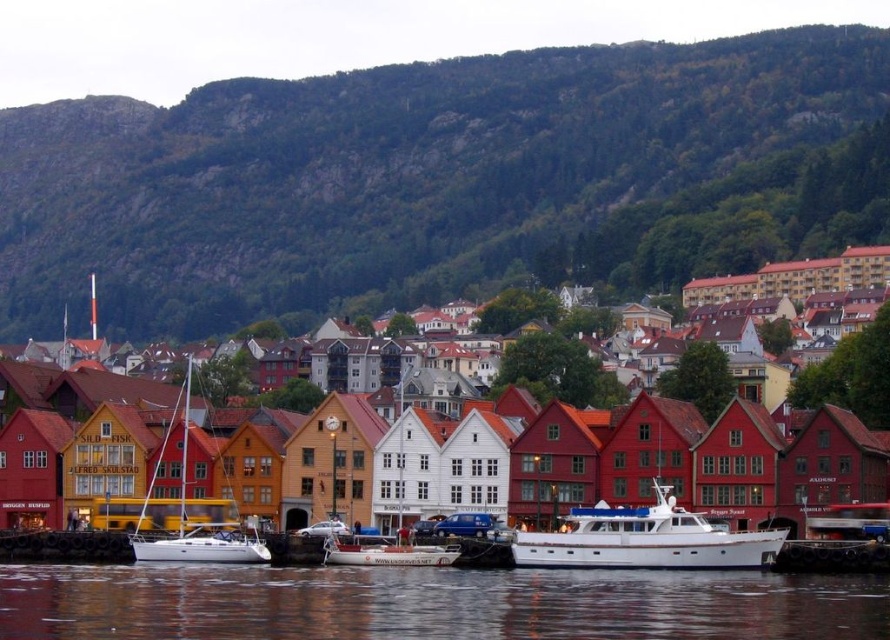
Consider the image. You are standing on the pier and see both the white glossy boat at center and the white matte boat at center. Which boat is positioned to the right side?

The white glossy boat at center is positioned to the right of the white matte boat at center.

You are standing on the pier looking out at the waterfront scene. You see the transparent water at lower center and the white glossy boat at center. Which object is located lower in the image?

The transparent water at lower center is located lower in the image than the white glossy boat at center.

You are a photographer planning to take a photo of the waterfront scene. You want to ensure both the white matte sailboat at center and the white matte boat at center are clearly visible in your shot. Which boat should you focus on first to capture their heights accurately?

The white matte sailboat at center is taller than the white matte boat at center, so you should focus on the white matte sailboat at center first to ensure its full height is captured before adjusting for the shorter boat.